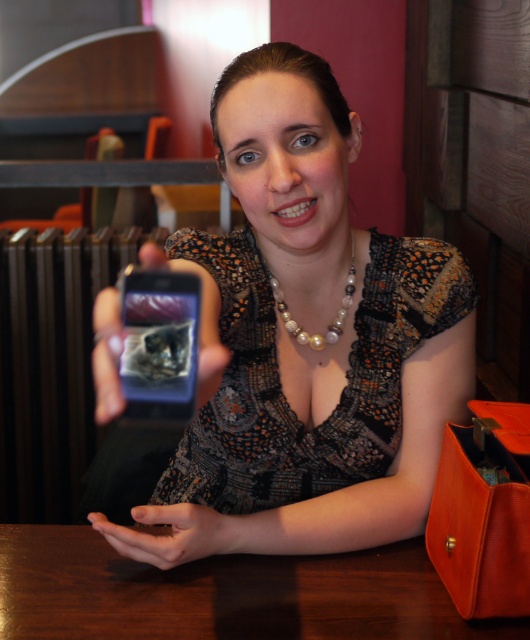
You are a photographer adjusting your camera to focus on the printed fabric dress at center and the smooth skin hand at lower center. Which object should you focus on first to ensure it appears sharp in the photo?

You should focus on the printed fabric dress at center first because it is closer to the viewer than the smooth skin hand at lower center, so it requires focusing on the closer object first for sharpness.

You are a photographer trying to capture the scene. Which object, the printed fabric dress at center or the smooth skin hand at lower center, is positioned higher in the image?

The printed fabric dress at center is positioned higher than the smooth skin hand at lower center.